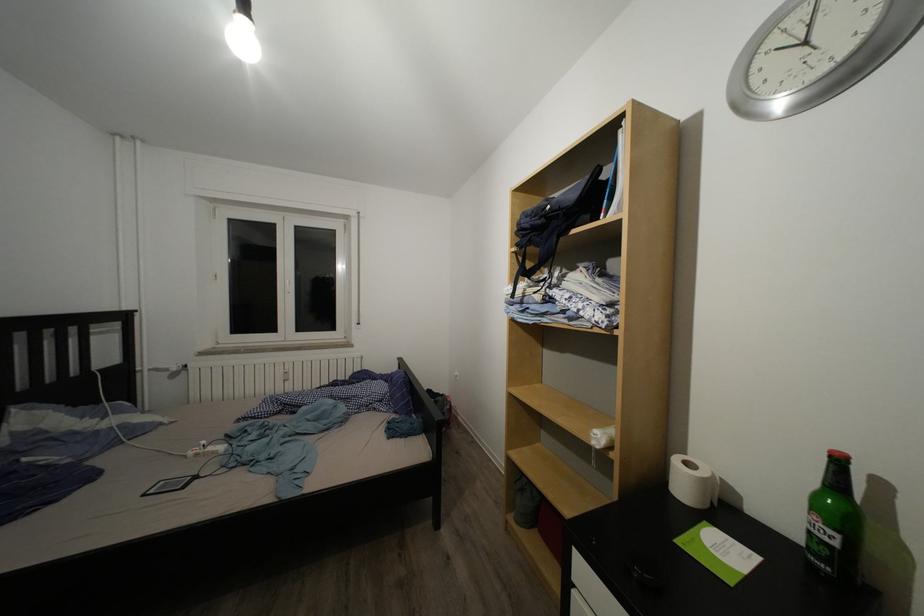
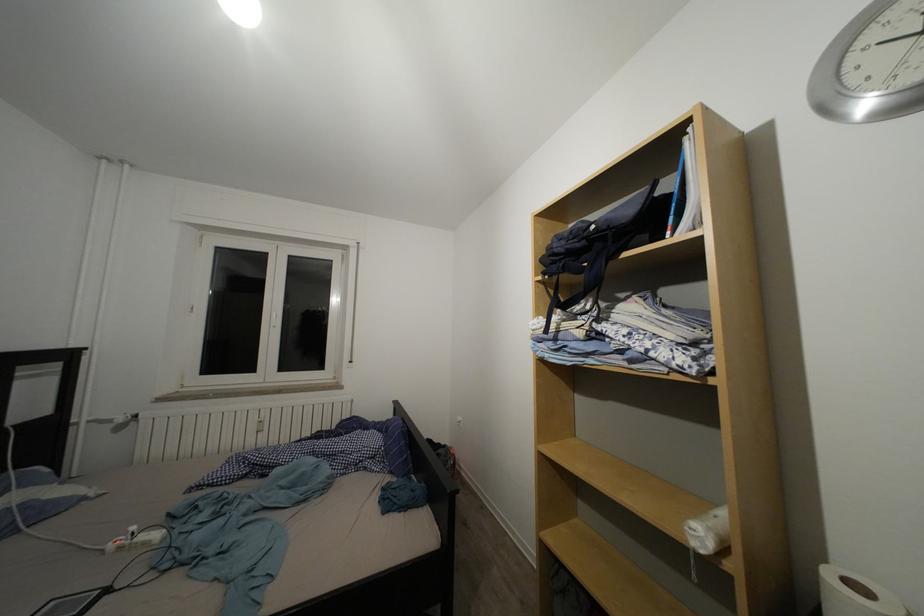
Where in the second image is the point corresponding to point (684, 467) from the first image?

(837, 584)